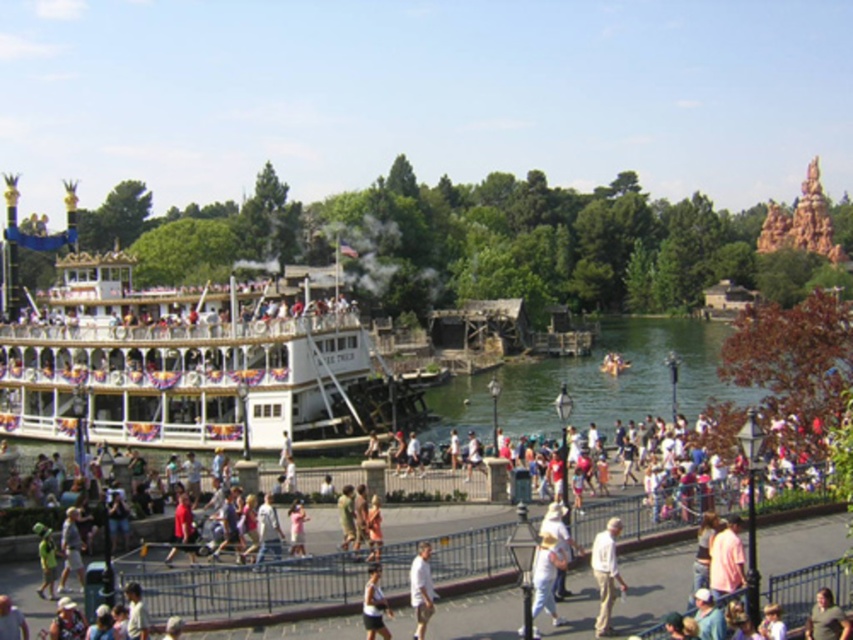
Question: Can you confirm if white polished wood boat at left is positioned above pink fabric shirt at lower right?

Choices:
 (A) no
 (B) yes

Answer: (B)

Question: Which object is the closest to the white cotton shirt at lower center?

Choices:
 (A) light brown leather jacket at center
 (B) white cotton shirt at center
 (C) light beige shorts at center
 (D) white polished wood boat at left

Answer: (C)

Question: Which of the following is the farthest from the observer?

Choices:
 (A) light beige shorts at center
 (B) light brown leather jacket at center
 (C) white cotton shirt at lower center
 (D) pink fabric shirt at lower right

Answer: (A)

Question: Which point is farther to the camera?

Choices:
 (A) light beige shorts at center
 (B) white cotton shirt at center
 (C) pink satin dress at center
 (D) white polished wood boat at left

Answer: (D)

Question: From the image, what is the correct spatial relationship of white polished wood boat at left in relation to white cotton shirt at center?

Choices:
 (A) right
 (B) left

Answer: (B)

Question: Is pink fabric shirt at lower right further to camera compared to light beige shorts at center?

Choices:
 (A) no
 (B) yes

Answer: (A)